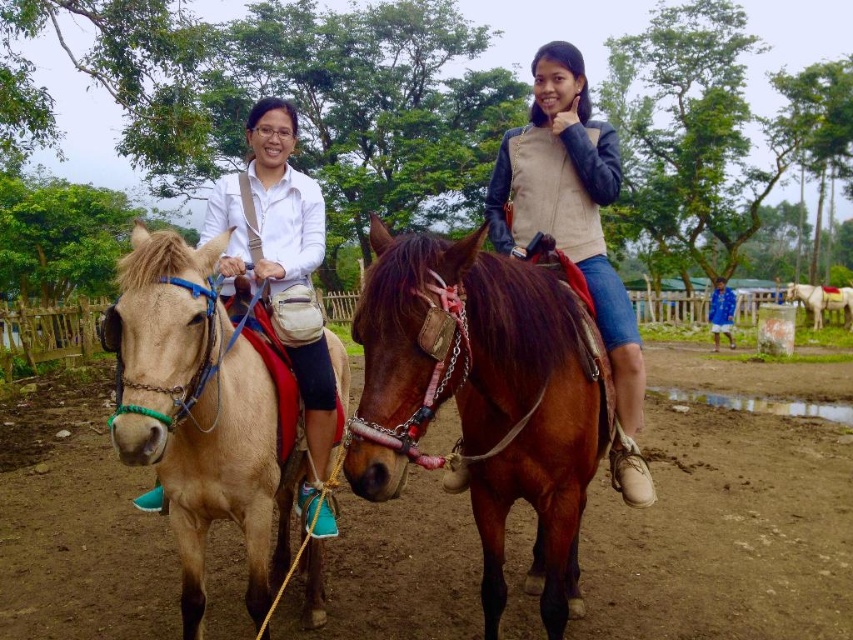
Question: Which object is farther from the camera taking this photo?

Choices:
 (A) light brown glossy horse at center
 (B) blue fabric jacket at lower right

Answer: (A)

Question: Can you confirm if matte beige vest at center is bigger than light brown glossy horse at center?

Choices:
 (A) no
 (B) yes

Answer: (A)

Question: Is brown soil at center positioned at the back of blue fabric jacket at lower right?

Choices:
 (A) no
 (B) yes

Answer: (A)

Question: Is brown soil at center above matte beige vest at center?

Choices:
 (A) no
 (B) yes

Answer: (A)

Question: Estimate the real-world distances between objects in this image. Which object is closer to the light brown leather horse at left?

Choices:
 (A) brown soil at center
 (B) light brown glossy horse at center
 (C) brown glossy horse at center
 (D) matte beige vest at center

Answer: (C)

Question: Which object is farther from the camera taking this photo?

Choices:
 (A) blue fabric jacket at lower right
 (B) light brown glossy horse at center
 (C) matte beige vest at center

Answer: (B)